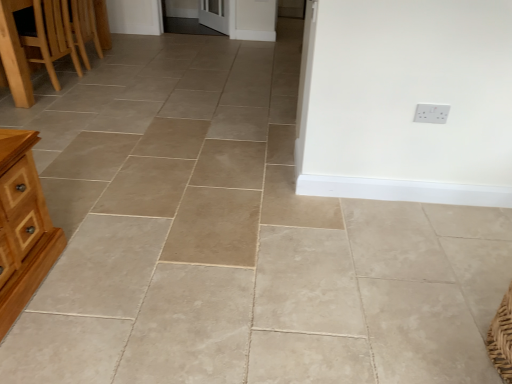
Question: Considering the relative positions of light brown wooden table at left and white plastic electric outlet at upper right in the image provided, is light brown wooden table at left in front of white plastic electric outlet at upper right?

Choices:
 (A) yes
 (B) no

Answer: (B)

Question: Is light brown wooden table at left not within white plastic electric outlet at upper right?

Choices:
 (A) yes
 (B) no

Answer: (A)

Question: Is light brown wooden table at left to the right of white plastic electric outlet at upper right from the viewer's perspective?

Choices:
 (A) no
 (B) yes

Answer: (A)

Question: Does light brown wooden table at left have a smaller size compared to white plastic electric outlet at upper right?

Choices:
 (A) yes
 (B) no

Answer: (B)

Question: From the image's perspective, is light brown wooden table at left under white plastic electric outlet at upper right?

Choices:
 (A) no
 (B) yes

Answer: (A)

Question: Is white plastic electric outlet at upper right wider or thinner than light brown wooden table at left?

Choices:
 (A) thin
 (B) wide

Answer: (A)

Question: Is white plastic electric outlet at upper right bigger or smaller than light brown wooden table at left?

Choices:
 (A) small
 (B) big

Answer: (A)

Question: Considering the relative positions of white plastic electric outlet at upper right and light brown wooden table at left in the image provided, is white plastic electric outlet at upper right to the left or to the right of light brown wooden table at left?

Choices:
 (A) left
 (B) right

Answer: (B)

Question: Is white plastic electric outlet at upper right inside the boundaries of light brown wooden table at left, or outside?

Choices:
 (A) inside
 (B) outside

Answer: (B)

Question: Considering the positions of light brown wooden table at left and white plastic electric outlet at upper right in the image, is light brown wooden table at left taller or shorter than white plastic electric outlet at upper right?

Choices:
 (A) short
 (B) tall

Answer: (B)

Question: Is light brown wooden table at left spatially inside white plastic electric outlet at upper right, or outside of it?

Choices:
 (A) outside
 (B) inside

Answer: (A)

Question: In terms of width, does light brown wooden table at left look wider or thinner when compared to white plastic electric outlet at upper right?

Choices:
 (A) wide
 (B) thin

Answer: (A)

Question: From a real-world perspective, is light brown wooden table at left positioned above or below white plastic electric outlet at upper right?

Choices:
 (A) above
 (B) below

Answer: (B)

Question: Based on their sizes in the image, would you say white plastic electric outlet at upper right is bigger or smaller than wooden chair at left?

Choices:
 (A) small
 (B) big

Answer: (A)

Question: Looking at their shapes, would you say white plastic electric outlet at upper right is wider or thinner than wooden chair at left?

Choices:
 (A) thin
 (B) wide

Answer: (A)